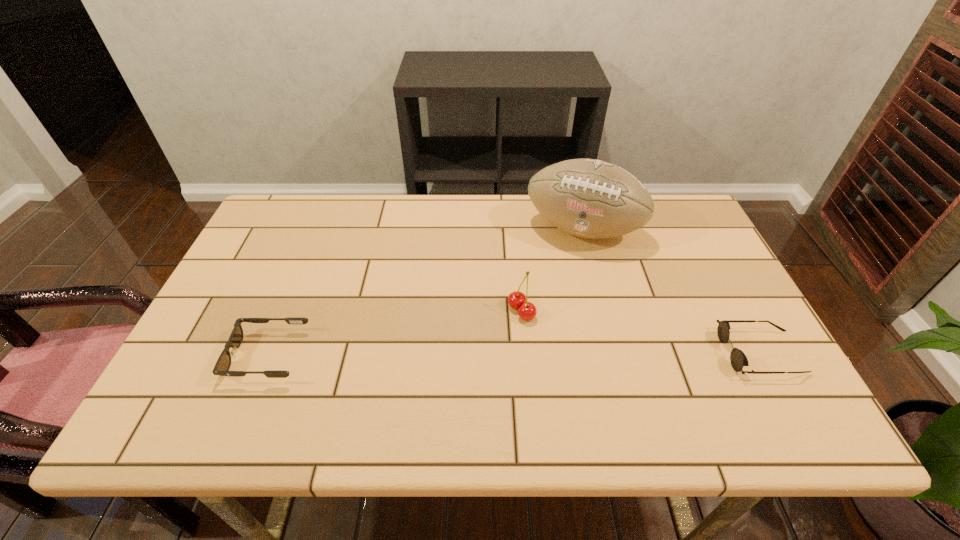
What are the coordinates of `free spot between the second farthest object and the left sunglasses` in the screenshot? It's located at (395, 334).

Identify the location of vacant space that's between the left sunglasses and the right sunglasses. This screenshot has height=540, width=960. (514, 354).

This screenshot has width=960, height=540. I want to click on empty space between the farthest object and the left sunglasses, so click(425, 292).

At what (x,y) coordinates should I click in order to perform the action: click on vacant point located between the leftmost object and the football (American). Please return your answer as a coordinate pair (x, y). This screenshot has width=960, height=540. Looking at the image, I should click on (425, 292).

The image size is (960, 540). I want to click on free spot between the football (American) and the cherry, so click(x=552, y=270).

I want to click on free space between the cherry and the football (American), so click(552, 270).

I want to click on vacant space that's between the left sunglasses and the third nearest object, so click(395, 334).

Where is `free space between the rightmost object and the leftmost object`? free space between the rightmost object and the leftmost object is located at coordinates (514, 354).

This screenshot has height=540, width=960. Identify the location of unoccupied position between the rightmost object and the second tallest object. (641, 332).

Point out which object is positioned as the nearest to the third shortest object. Please provide its 2D coordinates. Your answer should be formatted as a tuple, i.e. [(x, y)], where the tuple contains the x and y coordinates of a point satisfying the conditions above.

[(588, 198)]